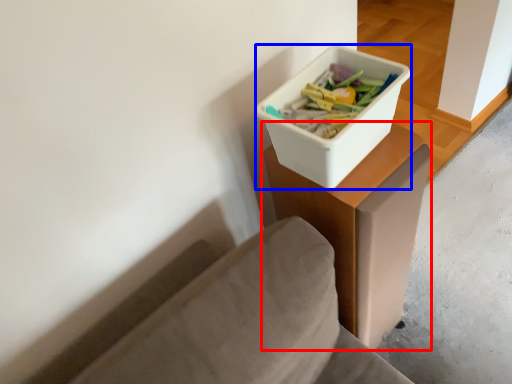
Question: Among these objects, which one is farthest to the camera, table (highlighted by a red box) or storage box (highlighted by a blue box)?

Choices:
 (A) table
 (B) storage box

Answer: (A)